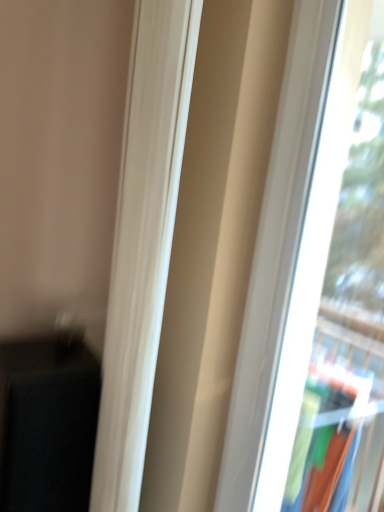
Describe the element at coordinates (292, 249) in the screenshot. Image resolution: width=384 pixels, height=512 pixels. I see `transparent glass window at right` at that location.

Find the location of a particular element. Image resolution: width=384 pixels, height=512 pixels. transparent glass window at right is located at coordinates (292, 249).

Find the location of `transparent glass window at right`. transparent glass window at right is located at coordinates (292, 249).